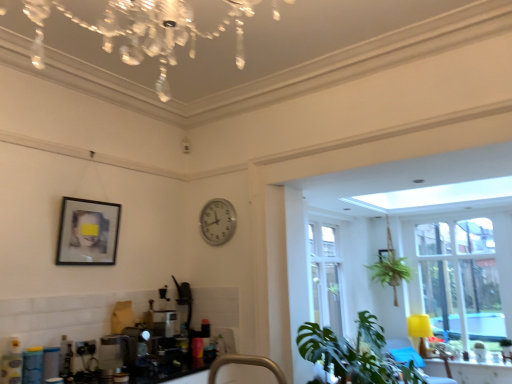
This screenshot has width=512, height=384. Describe the element at coordinates (88, 232) in the screenshot. I see `matte black picture frame at upper left, the 2th picture frame positioned from the bottom` at that location.

This screenshot has height=384, width=512. What do you see at coordinates (466, 278) in the screenshot?
I see `clear glass window at right` at bounding box center [466, 278].

Measure the distance between point (187,8) and camera.

Point (187,8) is 4.43 feet from camera.

Find the location of `satin silver toaster at lower left`. satin silver toaster at lower left is located at coordinates (113, 353).

You are a GUI agent. You are given a task and a screenshot of the screen. Output one action in this format:
    pyautogui.click(x=<x>, y=<y>)
    Task: Click on the matte black picture frame at upper left, which is the 1th picture frame in front-to-back order
    
    Given the screenshot: What is the action you would take?
    pyautogui.click(x=88, y=232)

Considering the positions of objects yellow matte lamp at right and matte black picture frame at upper left, the 2th picture frame viewed from the back, in the image provided, who is more to the right, yellow matte lamp at right or matte black picture frame at upper left, the 2th picture frame viewed from the back,?

yellow matte lamp at right.

Looking at the image, does yellow matte lamp at right seem bigger or smaller compared to matte black picture frame at upper left, the 2th picture frame viewed from the back?

In the image, yellow matte lamp at right appears to be larger than matte black picture frame at upper left, the 2th picture frame viewed from the back.

From the image's perspective, is yellow matte lamp at right above matte black picture frame at upper left, acting as the 2th picture frame starting from the right?

No, from the image's perspective, yellow matte lamp at right is not on top of matte black picture frame at upper left, acting as the 2th picture frame starting from the right.

The height and width of the screenshot is (384, 512). Find the location of `light fixture above the clear glass window at right (from the image's perspective)`. light fixture above the clear glass window at right (from the image's perspective) is located at coordinates (144, 31).

Consider the image. Is clear glass window at right facing away from crystal glass chandelier at upper center?

No, clear glass window at right is not facing the opposite direction of crystal glass chandelier at upper center.

Based on the photo, is clear glass window at right wider than crystal glass chandelier at upper center?

No, clear glass window at right is not wider than crystal glass chandelier at upper center.

Considering the sizes of crystal glass chandelier at upper center and matte black picture frame at upper right, placed as the 1th picture frame when sorted from bottom to top, in the image, is crystal glass chandelier at upper center taller or shorter than matte black picture frame at upper right, placed as the 1th picture frame when sorted from bottom to top,?

Considering their sizes, crystal glass chandelier at upper center has less height than matte black picture frame at upper right, placed as the 1th picture frame when sorted from bottom to top.

Is crystal glass chandelier at upper center aimed at matte black picture frame at upper right, the 2th picture frame viewed from the left?

No, crystal glass chandelier at upper center is not facing towards matte black picture frame at upper right, the 2th picture frame viewed from the left.

Which is behind, crystal glass chandelier at upper center or matte black picture frame at upper right, the first picture frame from the right?

matte black picture frame at upper right, the first picture frame from the right, is further away from the camera.

In the scene shown: Which is closer, (x=149, y=25) or (x=380, y=256)?

Point (x=149, y=25)

Is point (106, 363) closer to camera compared to point (384, 259)?

Yes, point (106, 363) is closer to viewer.

Is satin silver toaster at lower left taller than matte black picture frame at upper right, which is counted as the 1th picture frame, starting from the back?

Correct, satin silver toaster at lower left is much taller as matte black picture frame at upper right, which is counted as the 1th picture frame, starting from the back.

Is matte black picture frame at upper right, which is counted as the 1th picture frame, starting from the back, inside satin silver toaster at lower left?

No, matte black picture frame at upper right, which is counted as the 1th picture frame, starting from the back, is not a part of satin silver toaster at lower left.

Is satin silver toaster at lower left turned away from matte black picture frame at upper right, placed as the 1th picture frame when sorted from bottom to top?

That's not correct — satin silver toaster at lower left is not looking away from matte black picture frame at upper right, placed as the 1th picture frame when sorted from bottom to top.

Can you confirm if brushed metal faucet at lower center is positioned to the left of matte white window sill at lower right?

Indeed, brushed metal faucet at lower center is positioned on the left side of matte white window sill at lower right.

Does brushed metal faucet at lower center turn towards matte white window sill at lower right?

No, brushed metal faucet at lower center is not aimed at matte white window sill at lower right.

The width and height of the screenshot is (512, 384). Find the location of `window sill behind the brushed metal faucet at lower center`. window sill behind the brushed metal faucet at lower center is located at coordinates (478, 364).

Based on the photo, what's the angular difference between matte black picture frame at upper left, which is the 1th picture frame in front-to-back order, and green leafy plant at lower right's facing directions?

The angular difference between matte black picture frame at upper left, which is the 1th picture frame in front-to-back order, and green leafy plant at lower right is 0.0642 degrees.

Is matte black picture frame at upper left, which is counted as the first picture frame, starting from the left, not close to green leafy plant at lower right?

Indeed, matte black picture frame at upper left, which is counted as the first picture frame, starting from the left, is not near green leafy plant at lower right.

Is point (111, 238) closer to viewer compared to point (333, 358)?

No, (111, 238) is further to viewer.

Based on the photo, is matte black picture frame at upper left, which is the 1th picture frame in front-to-back order, facing towards green leafy plant at lower right?

No, matte black picture frame at upper left, which is the 1th picture frame in front-to-back order, is not facing towards green leafy plant at lower right.

Can you confirm if clear glass window at right is wider than green leafy plant at lower right?

No.

Does clear glass window at right have a greater height compared to green leafy plant at lower right?

Indeed, clear glass window at right has a greater height compared to green leafy plant at lower right.

Is clear glass window at right facing towards green leafy plant at lower right?

Yes, clear glass window at right is turned towards green leafy plant at lower right.

Is clear glass window at right outside of green leafy plant at lower right?

Yes, clear glass window at right is not within green leafy plant at lower right.

Image resolution: width=512 pixels, height=384 pixels. Identify the location of the 2nd picture frame counting from the left side of the yellow matte lamp at right. (88, 232).

You are a GUI agent. You are given a task and a screenshot of the screen. Output one action in this format:
    pyautogui.click(x=<x>, y=<y>)
    Task: Click on the window lying behind the crystal glass chandelier at upper center
    This screenshot has height=384, width=512.
    Given the screenshot: What is the action you would take?
    [466, 278]

When comparing their distances from silver metallic clock at upper center, does yellow matte lamp at right or matte black picture frame at upper right, the second picture frame when ordered from front to back, seem closer?

matte black picture frame at upper right, the second picture frame when ordered from front to back, is closer to silver metallic clock at upper center.

Based on the photo, considering their positions, is green leafy plant at lower right positioned closer to silver metallic clock at upper center than clear glass window at right?

green leafy plant at lower right.

Estimate the real-world distances between objects in this image. Which object is further from green leafy plant at lower right, velvet yellow armchair at lower right or matte black picture frame at upper left, the 2th picture frame positioned from the bottom?

velvet yellow armchair at lower right lies further to green leafy plant at lower right than the other object.

Which object lies nearer to the anchor point brushed metal faucet at lower center, matte black picture frame at upper left, which is the 1th picture frame in front-to-back order, or yellow matte lamp at right?

matte black picture frame at upper left, which is the 1th picture frame in front-to-back order, is positioned closer to the anchor brushed metal faucet at lower center.

When comparing their distances from yellow matte lamp at right, does matte black picture frame at upper left, which is counted as the first picture frame, starting from the left, or matte black picture frame at upper right, acting as the 2th picture frame starting from the top, seem closer?

matte black picture frame at upper right, acting as the 2th picture frame starting from the top, is positioned closer to the anchor yellow matte lamp at right.

When comparing their distances from green leafy plant at lower right, does matte black picture frame at upper right, acting as the 2th picture frame starting from the top, or satin silver toaster at lower left seem closer?

satin silver toaster at lower left.

From the image, which object appears to be nearer to satin silver toaster at lower left, yellow matte lamp at right or matte black picture frame at upper right, which is counted as the 1th picture frame, starting from the back?

matte black picture frame at upper right, which is counted as the 1th picture frame, starting from the back.

Considering their positions, is matte white window sill at lower right positioned further to clear glass window at right than matte black picture frame at upper left, acting as the 2th picture frame starting from the right?

Based on the image, matte black picture frame at upper left, acting as the 2th picture frame starting from the right, appears to be further to clear glass window at right.

At what (x,y) coordinates should I click in order to perform the action: click on picture frame between silver metallic clock at upper center and velvet yellow armchair at lower right in the horizontal direction. Please return your answer as a coordinate pair (x, y). The height and width of the screenshot is (384, 512). Looking at the image, I should click on (385, 254).

What are the coordinates of `faucet between crystal glass chandelier at upper center and green leafy plant at lower right in the up-down direction` in the screenshot? It's located at (246, 364).

The width and height of the screenshot is (512, 384). In order to click on houseplant between brushed metal faucet at lower center and yellow matte lamp at right in the front-back direction in this screenshot , I will do `click(348, 351)`.

Where is `window sill between green leafy plant at lower right and yellow matte lamp at right along the z-axis`? window sill between green leafy plant at lower right and yellow matte lamp at right along the z-axis is located at coordinates (478, 364).